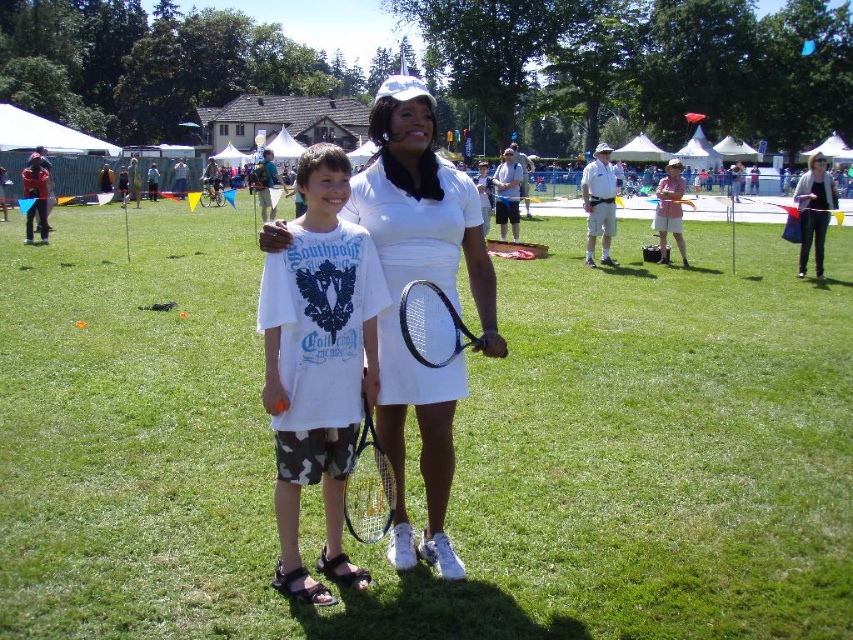
You are a photographer at the event and want to capture a photo where both the white matte tennis dress at center and the black matte tennis racket at center are clearly visible. Considering their positions, which object will appear larger in the photo?

The white matte tennis dress at center will appear larger in the photo because it is closer to the viewer than the black matte tennis racket at center.